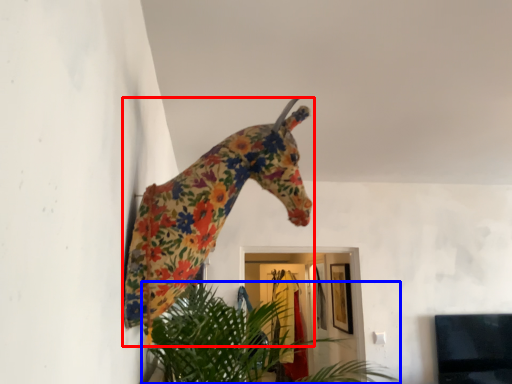
Question: Which of the following is the farthest to the observer, giraffe (highlighted by a red box) or houseplant (highlighted by a blue box)?

Choices:
 (A) giraffe
 (B) houseplant

Answer: (B)